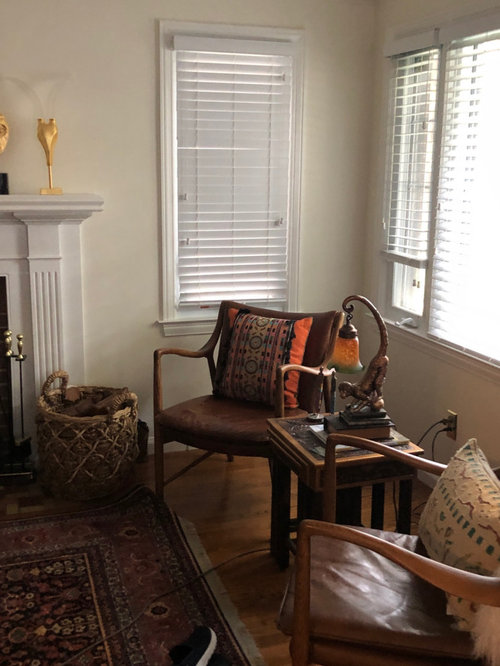
Locate an element on the screen. The image size is (500, 666). rug is located at coordinates (x=61, y=593).